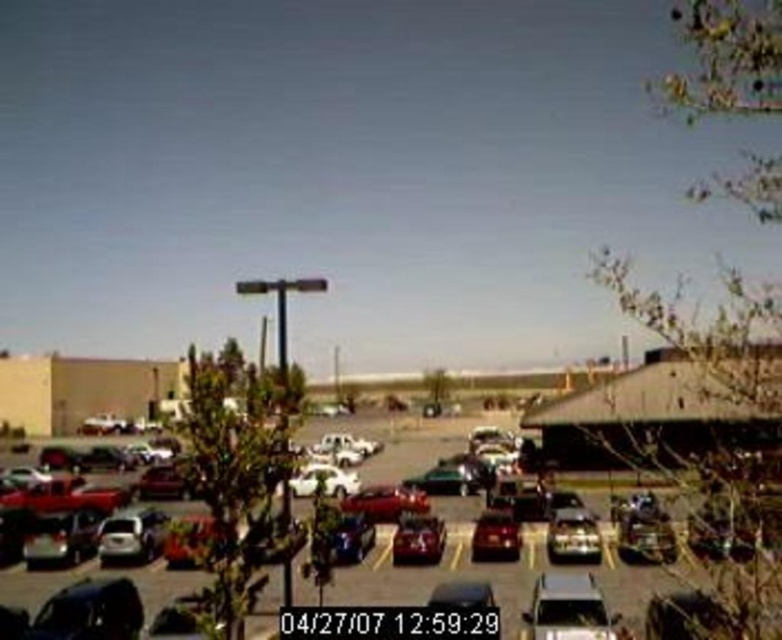
You are a parking attendant who needs to fit both the metallic silver car at center and the matte black car at center into a single parking space. Given that the parking space is designed for standard compact cars, which car might require more adjustments to fit properly?

The metallic silver car at center is bigger than the matte black car at center, so it would require more adjustments to fit into the standard compact parking space.

You are a delivery person who needs to park a 2.5 meters wide delivery van between the shiny silver sedan at center and the shiny red car at center. Is there enough space between them for your van?

The distance between the shiny silver sedan at center and the shiny red car at center is 3.24 meters. Since the van is 2.5 meters wide, there is enough space between them for the van to fit.

You are a delivery person trying to park your van in the parking lot. You see a metallic silver car at center and a silver metallic sedan at center. Which vehicle is blocking the path to the parking spot?

The metallic silver car at center is positioned under the silver metallic sedan at center, so the silver metallic sedan at center is blocking the path to the parking spot.